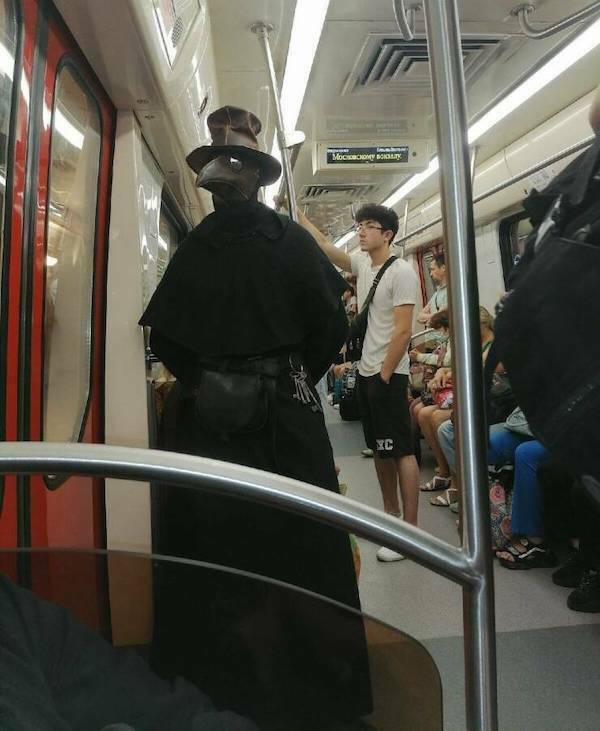
This screenshot has height=731, width=600. I want to click on dark gray floor surface, so click(x=557, y=686).